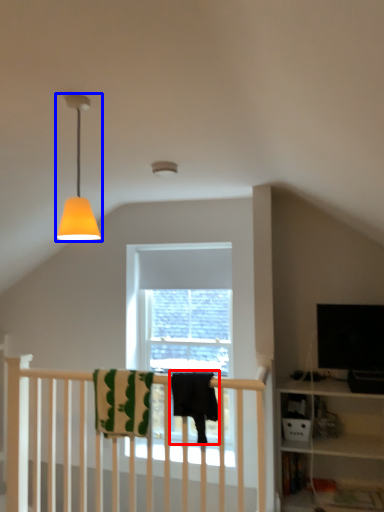
Question: Which object appears farthest to the camera in this image, beach towel (highlighted by a red box) or lamp (highlighted by a blue box)?

Choices:
 (A) beach towel
 (B) lamp

Answer: (A)